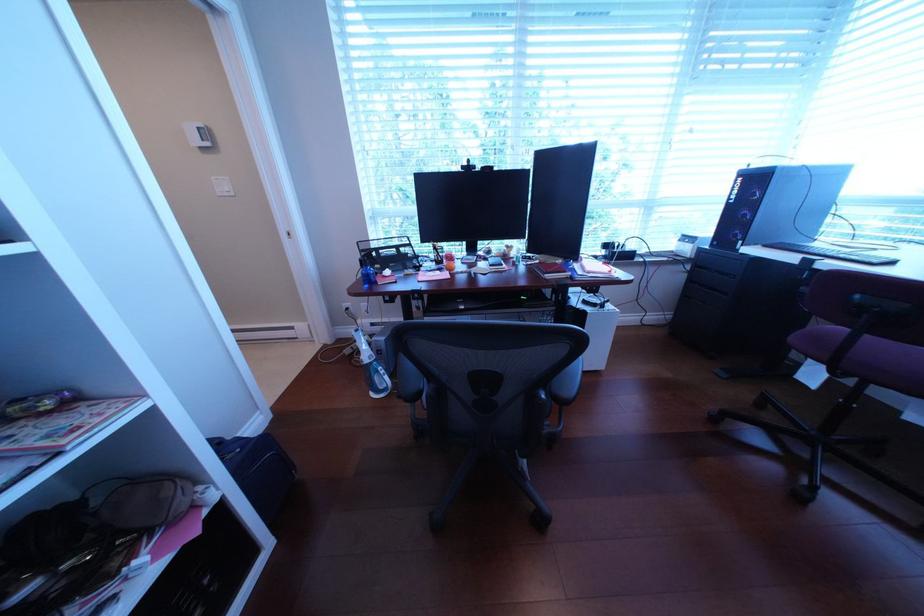
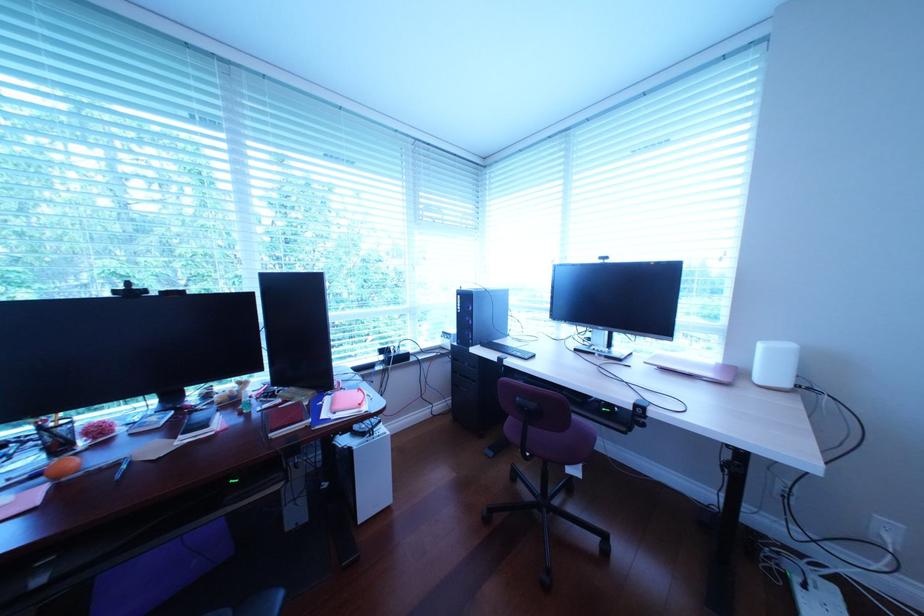
Question: Based on the continuous images, in which direction is the camera rotating? Reply with the corresponding letter.

Choices:
 (A) Left
 (B) Right
 (C) Up
 (D) Down

Answer: (B)